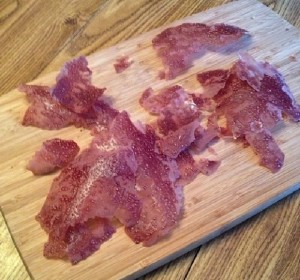
Identify the location of wooden cutting board on wooden counter. This screenshot has height=280, width=300. (212, 217), (218, 243).